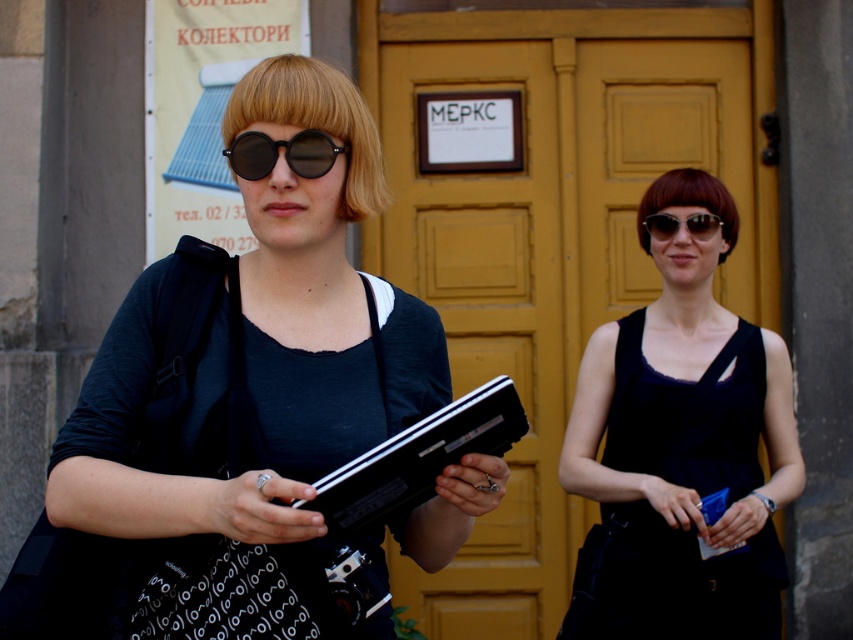
Question: Can you confirm if matte black laptop at left is bigger than black matte sunglasses at center?

Choices:
 (A) no
 (B) yes

Answer: (B)

Question: Which point is closer to the camera taking this photo?

Choices:
 (A) (305, 163)
 (B) (670, 221)
 (C) (292, 536)
 (D) (689, 605)

Answer: (C)

Question: Is black matte dress at center closer to the viewer compared to sunglasses at center?

Choices:
 (A) no
 (B) yes

Answer: (B)

Question: Which is nearer to the sunglasses at center?

Choices:
 (A) black matte dress at center
 (B) matte black laptop at left

Answer: (A)

Question: In this image, where is black matte sunglasses at center located relative to sunglasses at center?

Choices:
 (A) right
 (B) left

Answer: (B)

Question: Which is nearer to the sunglasses at center?

Choices:
 (A) matte black laptop at left
 (B) black matte dress at center
 (C) black matte sunglasses at center

Answer: (B)